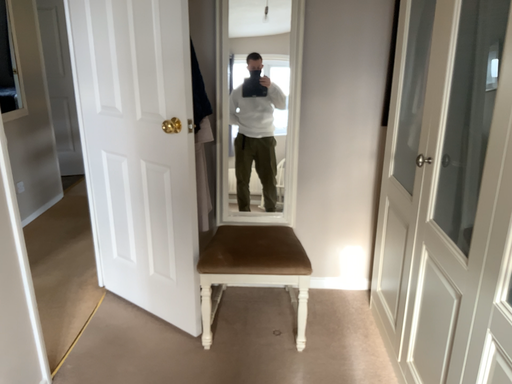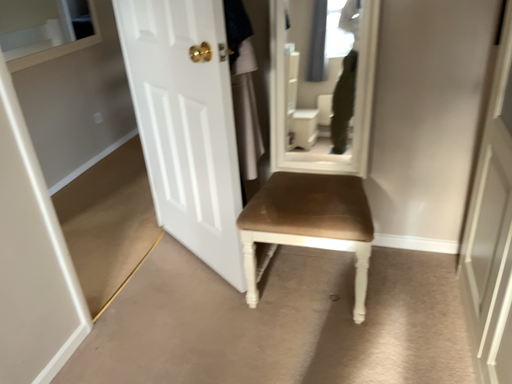
Question: How did the camera likely rotate when shooting the video?

Choices:
 (A) rotated left
 (B) rotated right

Answer: (A)